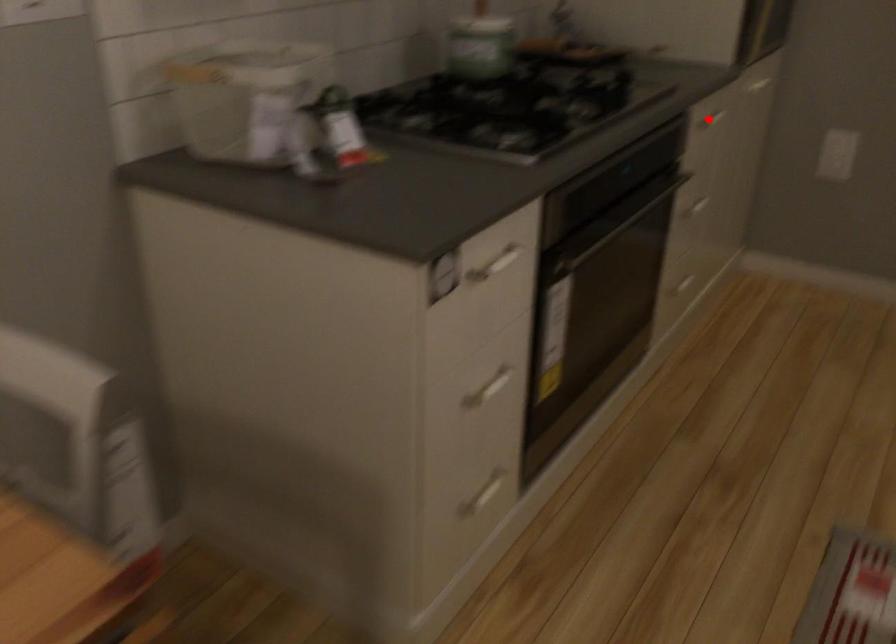
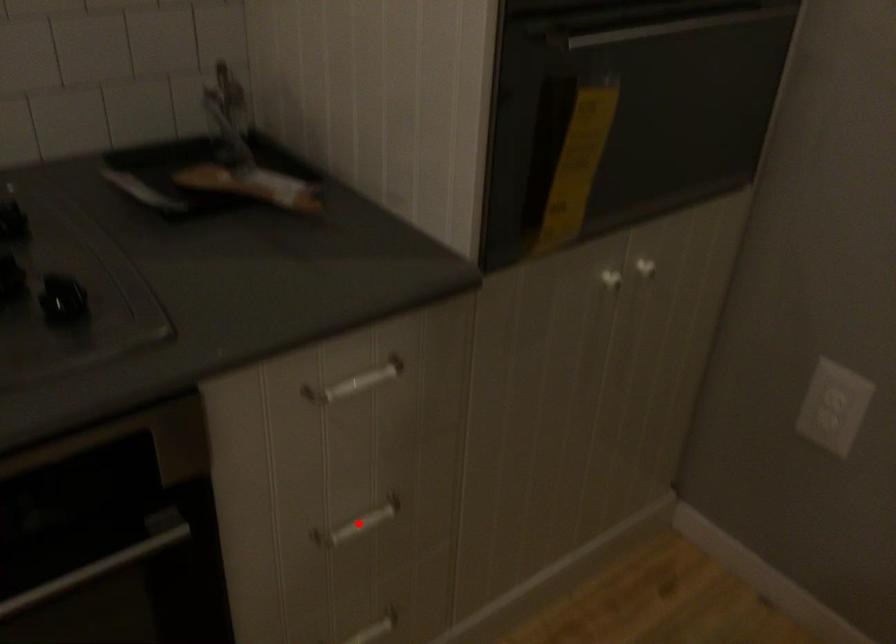
I am providing you with two images of the same scene from different viewpoints. A red point is marked on the first image and another point is marked on the second image. Are the points marked in image1 and image2 representing the same 3D position?

No